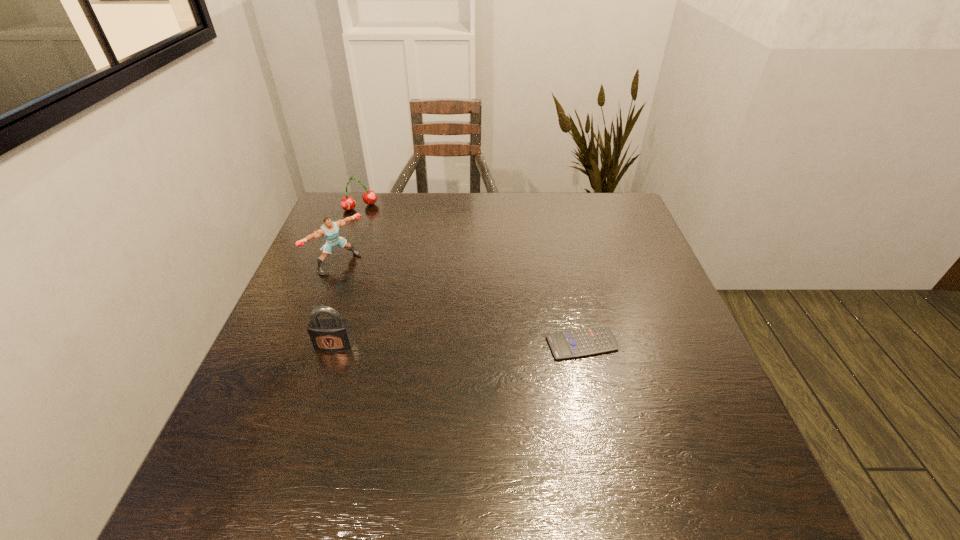
In order to click on free spot on the desktop that is between the padlock and the calculator and is positioned with stems pointing upwards on the cherry in this screenshot , I will do `click(440, 344)`.

Locate an element on the screen. The image size is (960, 540). vacant space on the desktop that is between the padlock and the shortest object and is positioned on the front-facing side of the third nearest object is located at coordinates (442, 344).